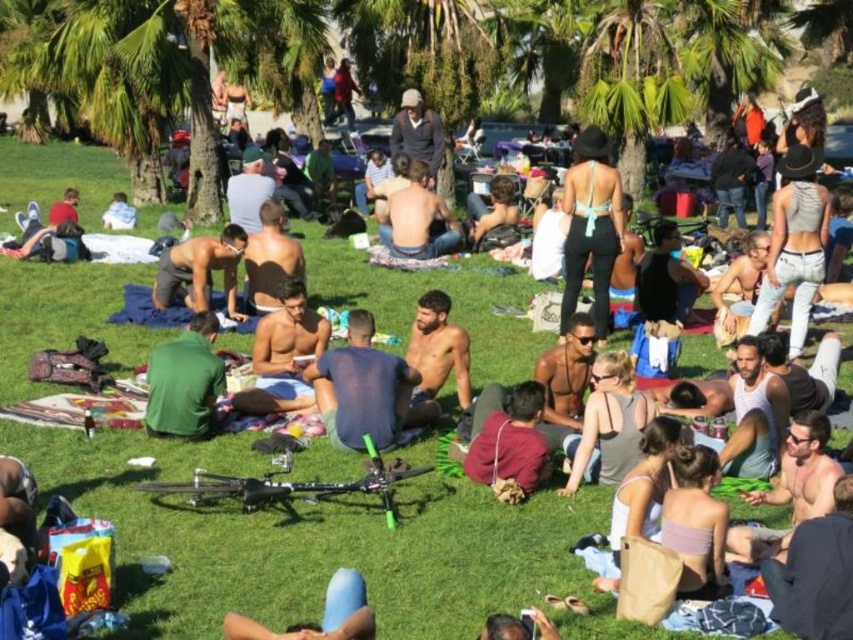
Who is more distant from viewer, (213, 403) or (248, 276)?

Positioned behind is point (248, 276).

Where is `green matte shirt at center`? This screenshot has height=640, width=853. green matte shirt at center is located at coordinates (184, 381).

Between green matte shirt at center and white fabric at center-left, which one appears on the left side from the viewer's perspective?

white fabric at center-left is more to the left.

The width and height of the screenshot is (853, 640). In order to click on green matte shirt at center in this screenshot , I will do `click(184, 381)`.

Locate an element on the screen. The height and width of the screenshot is (640, 853). green matte shirt at center is located at coordinates (184, 381).

Can you confirm if maroon fabric bag at center is positioned to the right of shiny metallic shirt at center?

Correct, you'll find maroon fabric bag at center to the right of shiny metallic shirt at center.

Which is behind, point (495, 440) or point (227, 276)?

The point (227, 276) is behind.

Does point (497, 413) come in front of point (180, 252)?

That is True.

I want to click on maroon fabric bag at center, so click(509, 444).